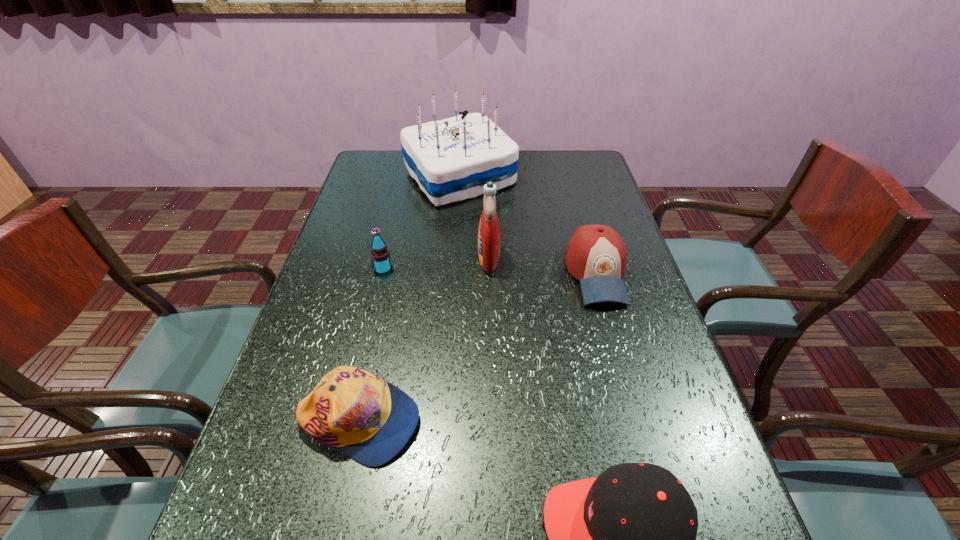
Locate an element on the screen. This screenshot has width=960, height=540. vacant region located on the front surface of the fifth shortest object is located at coordinates (448, 258).

This screenshot has height=540, width=960. In order to click on vacant point located on the front of the soda in this screenshot , I will do `click(375, 302)`.

The height and width of the screenshot is (540, 960). I want to click on vacant space located 0.200m on the front-facing side of the baseball cap, so click(627, 380).

This screenshot has height=540, width=960. Find the location of `free region located on the bill of the second nearest object`. free region located on the bill of the second nearest object is located at coordinates (445, 421).

Identify the location of object that is at the far edge. The height and width of the screenshot is (540, 960). (452, 159).

This screenshot has width=960, height=540. Find the location of `birthday cake that is at the left edge`. birthday cake that is at the left edge is located at coordinates (452, 159).

Locate an element on the screen. This screenshot has height=540, width=960. soda that is at the left edge is located at coordinates (380, 255).

Locate an element on the screen. The height and width of the screenshot is (540, 960). cap situated at the left edge is located at coordinates (370, 420).

Identify the location of object present at the right edge. (596, 255).

Where is `object positioned at the far left corner`? object positioned at the far left corner is located at coordinates click(x=452, y=159).